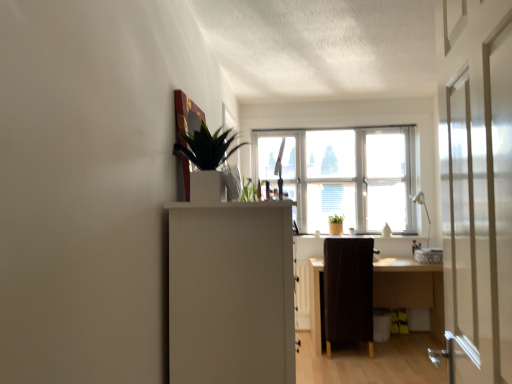
Question: Considering the relative positions of wooden desk at center and white glossy window sill at center in the image provided, is wooden desk at center to the right of white glossy window sill at center from the viewer's perspective?

Choices:
 (A) yes
 (B) no

Answer: (A)

Question: Can you confirm if wooden desk at center is positioned to the left of white glossy window sill at center?

Choices:
 (A) no
 (B) yes

Answer: (A)

Question: Can you confirm if wooden desk at center is smaller than white glossy window sill at center?

Choices:
 (A) yes
 (B) no

Answer: (B)

Question: From the image's perspective, is wooden desk at center beneath white glossy window sill at center?

Choices:
 (A) yes
 (B) no

Answer: (A)

Question: Is the depth of wooden desk at center less than that of white glossy window sill at center?

Choices:
 (A) yes
 (B) no

Answer: (A)

Question: From a real-world perspective, is white matte cabinet at center above or below green glossy plant at upper center?

Choices:
 (A) above
 (B) below

Answer: (B)

Question: Considering the positions of point (196, 284) and point (223, 142), is point (196, 284) closer or farther from the camera than point (223, 142)?

Choices:
 (A) closer
 (B) farther

Answer: (A)

Question: From their relative heights in the image, would you say white matte cabinet at center is taller or shorter than green glossy plant at upper center?

Choices:
 (A) short
 (B) tall

Answer: (B)

Question: Is white matte cabinet at center to the left or to the right of green glossy plant at upper center in the image?

Choices:
 (A) right
 (B) left

Answer: (A)

Question: Based on their positions, is wooden desk at center located to the left or right of white matte cabinet at center?

Choices:
 (A) right
 (B) left

Answer: (A)

Question: Would you say wooden desk at center is inside or outside white matte cabinet at center?

Choices:
 (A) outside
 (B) inside

Answer: (A)

Question: From the image's perspective, relative to white matte cabinet at center, is wooden desk at center above or below?

Choices:
 (A) above
 (B) below

Answer: (B)

Question: From their relative heights in the image, would you say wooden desk at center is taller or shorter than white matte cabinet at center?

Choices:
 (A) short
 (B) tall

Answer: (A)

Question: Considering the positions of point (397, 238) and point (473, 278), is point (397, 238) closer or farther from the camera than point (473, 278)?

Choices:
 (A) farther
 (B) closer

Answer: (A)

Question: From a real-world perspective, is white glossy window sill at center above or below white glossy screen door at right?

Choices:
 (A) below
 (B) above

Answer: (A)